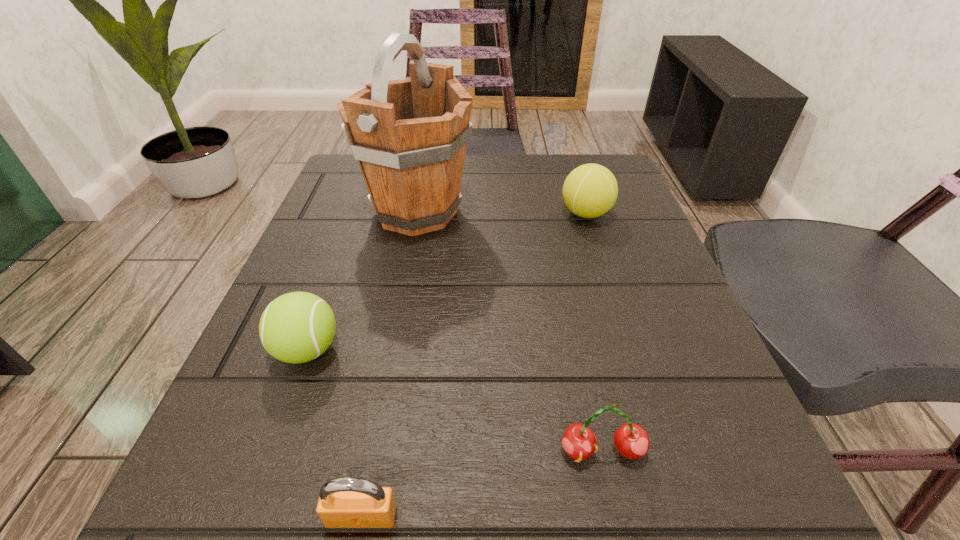
I want to click on the tallest object, so [x=409, y=136].

Locate an element on the screen. This screenshot has width=960, height=540. the right tennis ball is located at coordinates 590,190.

Where is `the nearer tennis ball`? the nearer tennis ball is located at coordinates (297, 327).

Locate an element on the screen. This screenshot has height=540, width=960. the third nearest object is located at coordinates (297, 327).

Locate an element on the screen. This screenshot has height=540, width=960. cherry is located at coordinates (631, 440).

In order to click on the shortest object in this screenshot , I will do `click(346, 502)`.

Locate an element on the screen. The width and height of the screenshot is (960, 540). the nearest object is located at coordinates (346, 502).

This screenshot has height=540, width=960. I want to click on blank space located on the front of the bucket, so click(371, 454).

You are a GUI agent. You are given a task and a screenshot of the screen. Output one action in this format:
    pyautogui.click(x=<x>, y=<y>)
    Task: Click on the vacant space located on the front of the right tennis ball
    The image size is (960, 540).
    Given the screenshot: What is the action you would take?
    pyautogui.click(x=620, y=322)

Image resolution: width=960 pixels, height=540 pixels. I want to click on free location located on the front of the third farthest object, so click(285, 411).